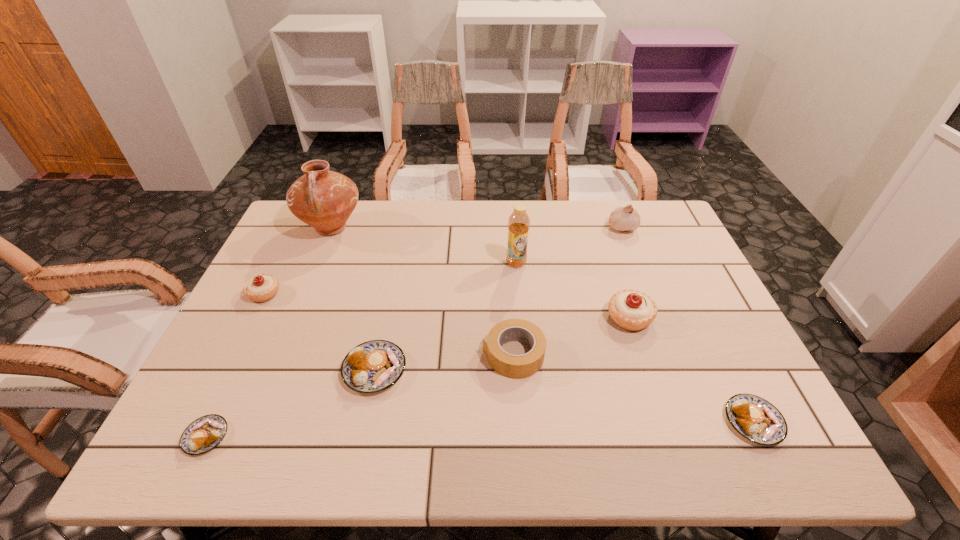
Locate an element on the screen. This screenshot has width=960, height=540. pottery is located at coordinates (323, 199).

The width and height of the screenshot is (960, 540). In order to click on the third farthest object in this screenshot , I will do `click(518, 223)`.

Image resolution: width=960 pixels, height=540 pixels. What are the coordinates of `garlic` in the screenshot? It's located at (622, 218).

The height and width of the screenshot is (540, 960). In order to click on the tallest pastry in this screenshot , I will do `click(633, 310)`.

You are a GUI agent. You are given a task and a screenshot of the screen. Output one action in this format:
    pyautogui.click(x=<x>, y=<y>)
    Task: Click on the second pastry from right to left
    
    Given the screenshot: What is the action you would take?
    pyautogui.click(x=633, y=310)

Where is `the smaller beige pastry`? This screenshot has height=540, width=960. the smaller beige pastry is located at coordinates (263, 287).

Locate an element on the screen. The width and height of the screenshot is (960, 540). the fourth shortest pastry is located at coordinates (263, 287).

Find the location of `duct tape`. duct tape is located at coordinates (512, 366).

You are a GUI agent. You are given a task and a screenshot of the screen. Output one action in this format:
    pyautogui.click(x=<x>, y=<y>)
    Task: Click on the third pastry from left to right
    The width and height of the screenshot is (960, 540).
    Given the screenshot: What is the action you would take?
    pyautogui.click(x=373, y=366)

Identify the location of the fourth object from left to right. Image resolution: width=960 pixels, height=540 pixels. pos(373,366).